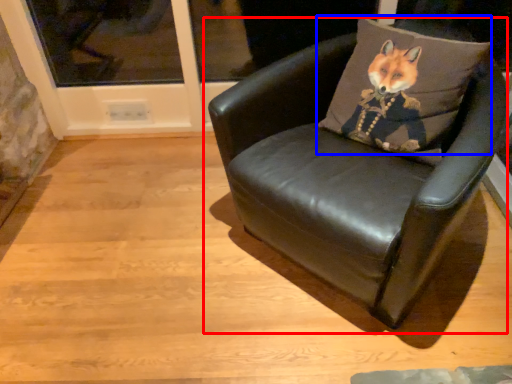
Question: Which point is further to the camera, chair (highlighted by a red box) or throw pillow (highlighted by a blue box)?

Choices:
 (A) chair
 (B) throw pillow

Answer: (B)